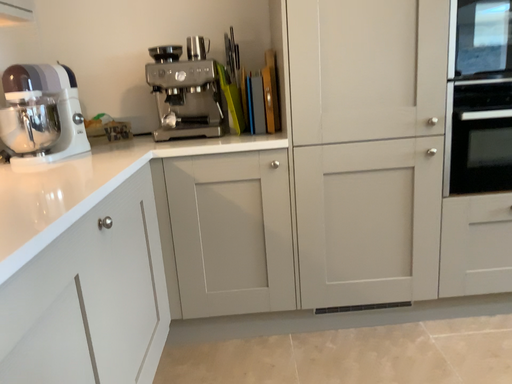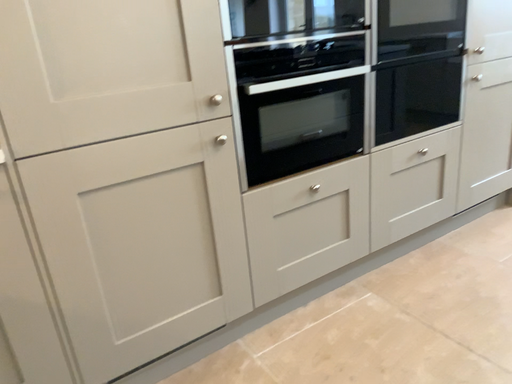
Question: How did the camera likely rotate when shooting the video?

Choices:
 (A) rotated left
 (B) rotated right

Answer: (B)